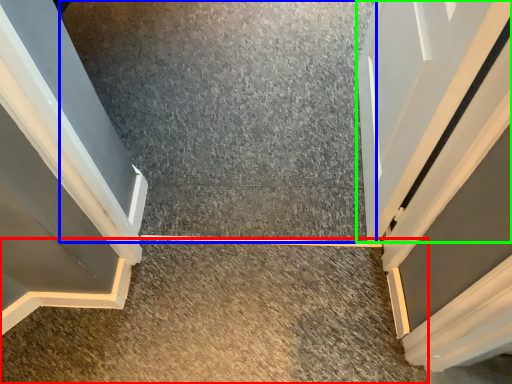
Question: Estimate the real-world distances between objects in this image. Which object is farther from concrete (highlighted by a red box), concrete (highlighted by a blue box) or door (highlighted by a green box)?

Choices:
 (A) concrete
 (B) door

Answer: (B)